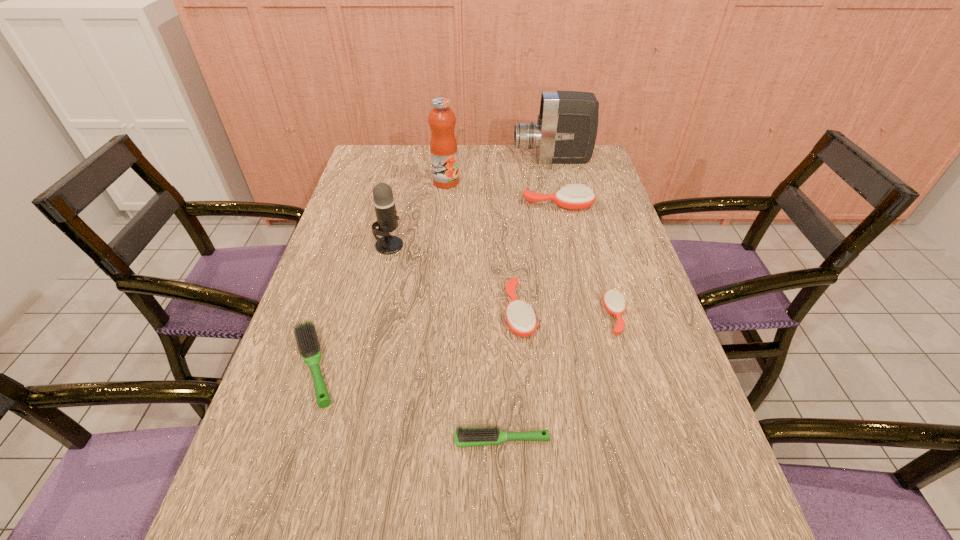
Identify the location of orange fruit juice. (443, 145).

The height and width of the screenshot is (540, 960). I want to click on the second farthest object, so click(443, 145).

At what (x,y) coordinates should I click in order to perform the action: click on the farthest object. Please return your answer as a coordinate pair (x, y). The image size is (960, 540). Looking at the image, I should click on [x=565, y=133].

You are a GUI agent. You are given a task and a screenshot of the screen. Output one action in this format:
    pyautogui.click(x=<x>, y=<y>)
    Task: Click on the microphone
    This screenshot has height=540, width=960.
    Given the screenshot: What is the action you would take?
    pyautogui.click(x=384, y=203)

Locate an element on the screen. The width and height of the screenshot is (960, 540). the fifth nearest object is located at coordinates (384, 203).

Identify the location of the third farthest object. (575, 197).

The width and height of the screenshot is (960, 540). Find the location of `the fifth shortest object`. the fifth shortest object is located at coordinates (575, 197).

The width and height of the screenshot is (960, 540). Find the location of `the second tallest hairbrush`. the second tallest hairbrush is located at coordinates (521, 319).

Where is `the second smallest orange hairbrush`? The height and width of the screenshot is (540, 960). the second smallest orange hairbrush is located at coordinates (521, 319).

You are a GUI agent. You are given a task and a screenshot of the screen. Output one action in this format:
    pyautogui.click(x=<x>, y=<y>)
    Task: Click on the farther light hairbrush
    
    Given the screenshot: What is the action you would take?
    tap(307, 339)